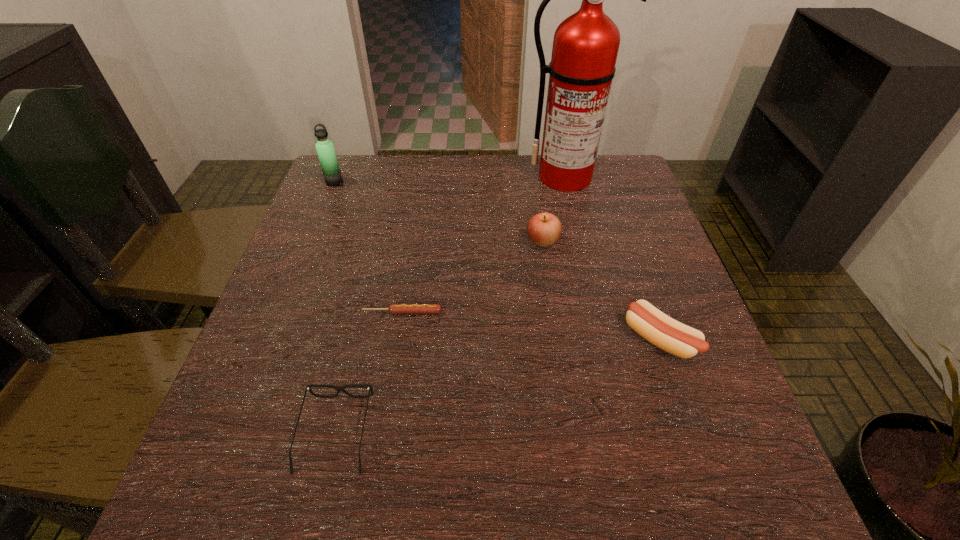
I want to click on fire extinguisher, so click(585, 46).

Find the location of a particular element. The width and height of the screenshot is (960, 540). thermos bottle is located at coordinates (325, 149).

Locate an element on the screen. the second tallest object is located at coordinates (325, 149).

At what (x,y) coordinates should I click in order to perform the action: click on apple. Please return your answer as a coordinate pair (x, y). The height and width of the screenshot is (540, 960). Looking at the image, I should click on (544, 229).

Find the location of a particular element. the third farthest object is located at coordinates (544, 229).

Identify the location of the taller sausage. The width and height of the screenshot is (960, 540). (670, 335).

Image resolution: width=960 pixels, height=540 pixels. Find the location of `the right sausage`. the right sausage is located at coordinates click(x=670, y=335).

The height and width of the screenshot is (540, 960). I want to click on spectacles, so click(308, 387).

This screenshot has height=540, width=960. Find the location of `the fifth tallest object`. the fifth tallest object is located at coordinates (308, 387).

Image resolution: width=960 pixels, height=540 pixels. Find the location of `the shortest object`. the shortest object is located at coordinates (393, 308).